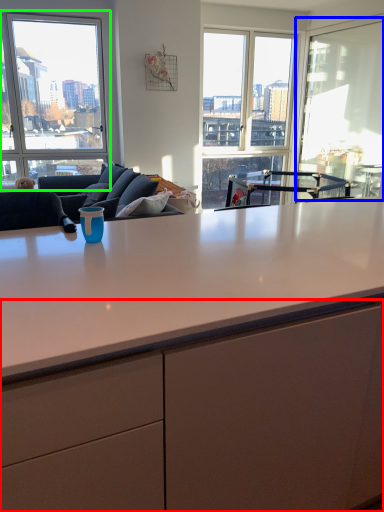
Question: Estimate the real-world distances between objects in this image. Which object is closer to cabinetry (highlighted by a red box), window screen (highlighted by a blue box) or window (highlighted by a green box)?

Choices:
 (A) window screen
 (B) window

Answer: (A)